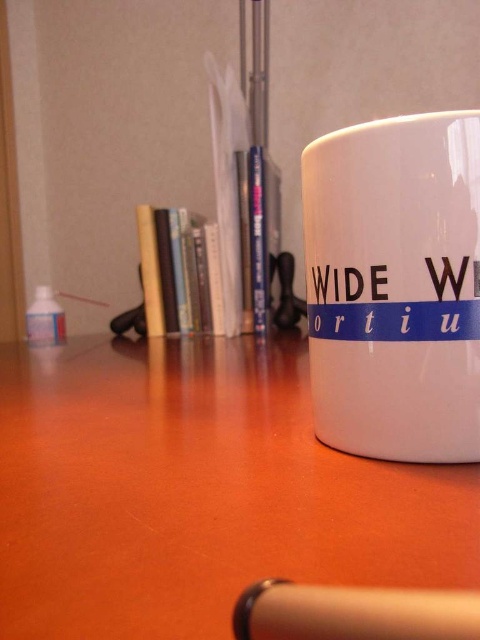
You are organizing a small event and need to place a decorative item on the matte wood table at center. However, there is already a white ceramic mug at right on it. Can the mug be moved to make space without removing the table?

The matte wood table at center is positioned under the white ceramic mug at right, which means the mug is placed on top of the table. Therefore, you can move the white ceramic mug at right to make space for the decorative item on the matte wood table at center.

You are holding a smartphone that is 6.5 inches wide. You want to take a photo of the matte wood table at center from your current position. Can the smartphone fit entirely within the frame if you position it directly facing the table?

The matte wood table at center is 8.78 inches from camera, so yes, the smartphone can fit entirely within the frame since its width is smaller than the distance to the table.

You are standing in front of the white ceramic mug on the wooden surface. There are two points marked on the image at coordinates point (372, 573) and point (299, 625). Which point is closer to you?

Point (299, 625) is closer to you because it is in front of point (372, 573) according to their positions.